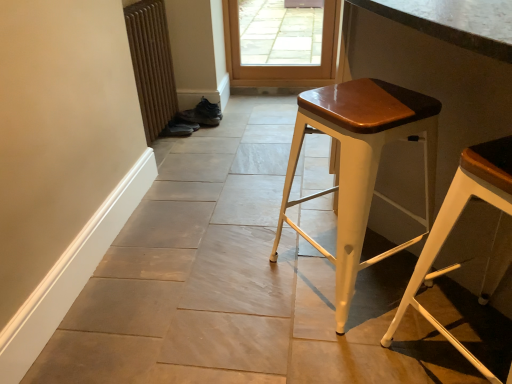
Question: From a real-world perspective, is leather brown shoe at center, the 2th shoe when ordered from bottom to top, positioned under shiny black shoe at lower center, which is the 2th shoe in top-to-bottom order, based on gravity?

Choices:
 (A) yes
 (B) no

Answer: (B)

Question: From the image's perspective, does leather brown shoe at center, the 1th shoe viewed from the top, appear lower than shiny black shoe at lower center, which is the 2th shoe in top-to-bottom order?

Choices:
 (A) no
 (B) yes

Answer: (A)

Question: Does leather brown shoe at center, the 2th shoe when ordered from bottom to top, come in front of shiny black shoe at lower center, which appears as the first shoe when ordered from the bottom?

Choices:
 (A) no
 (B) yes

Answer: (A)

Question: Is leather brown shoe at center, the 1th shoe viewed from the top, far away from shiny black shoe at lower center, which appears as the first shoe when ordered from the bottom?

Choices:
 (A) yes
 (B) no

Answer: (B)

Question: From the image's perspective, is leather brown shoe at center, the 2th shoe when ordered from bottom to top, on top of shiny black shoe at lower center, which appears as the first shoe when ordered from the bottom?

Choices:
 (A) yes
 (B) no

Answer: (A)

Question: Considering the relative sizes of leather brown shoe at center, the 1th shoe viewed from the top, and shiny black shoe at lower center, which appears as the first shoe when ordered from the bottom, in the image provided, is leather brown shoe at center, the 1th shoe viewed from the top, taller than shiny black shoe at lower center, which appears as the first shoe when ordered from the bottom,?

Choices:
 (A) no
 (B) yes

Answer: (B)

Question: Is white metal stool at right, the 2th stool viewed from the left, positioned before leather brown shoe at center, the 1th shoe viewed from the top?

Choices:
 (A) no
 (B) yes

Answer: (B)

Question: From the image's perspective, is white metal stool at right, marked as the 1th stool in a right-to-left arrangement, under leather brown shoe at center, the 1th shoe viewed from the top?

Choices:
 (A) no
 (B) yes

Answer: (B)

Question: Could you tell me if white metal stool at right, the 2th stool viewed from the left, is turned towards leather brown shoe at center, the 1th shoe viewed from the top?

Choices:
 (A) yes
 (B) no

Answer: (B)

Question: Is white metal stool at right, the 2th stool viewed from the left, positioned beyond the bounds of leather brown shoe at center, the 1th shoe viewed from the top?

Choices:
 (A) no
 (B) yes

Answer: (B)

Question: From a real-world perspective, does white metal stool at right, the 2th stool viewed from the left, stand above leather brown shoe at center, the 1th shoe viewed from the top?

Choices:
 (A) no
 (B) yes

Answer: (B)

Question: Is white metal stool at right, marked as the 1th stool in a right-to-left arrangement, bigger than leather brown shoe at center, the 1th shoe viewed from the top?

Choices:
 (A) no
 (B) yes

Answer: (B)

Question: Does matte white stool at center, which is counted as the second stool, starting from the right, appear on the left side of leather brown shoe at center, the 2th shoe when ordered from bottom to top?

Choices:
 (A) no
 (B) yes

Answer: (A)